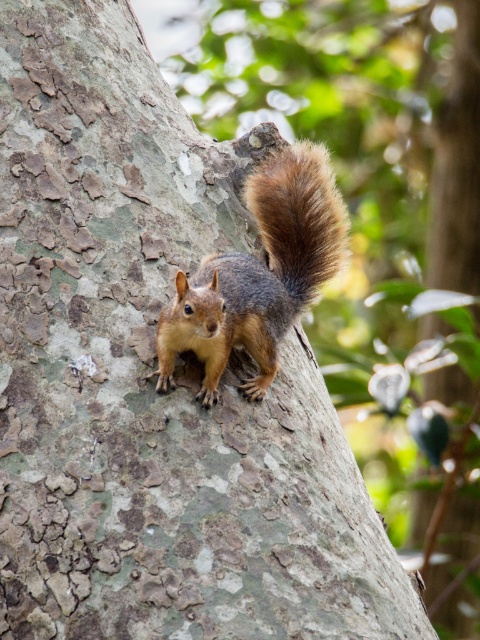
Question: Which of the following is the farthest from the observer?

Choices:
 (A) shiny brown fur squirrel at center
 (B) fuzzy brown tail at upper right

Answer: (B)

Question: Observing the image, what is the correct spatial positioning of shiny brown fur squirrel at center in reference to fuzzy brown tail at upper right?

Choices:
 (A) left
 (B) right

Answer: (A)

Question: Which point is closer to the camera taking this photo?

Choices:
 (A) (280, 184)
 (B) (162, 378)

Answer: (B)

Question: Does shiny brown fur squirrel at center have a larger size compared to fuzzy brown tail at upper right?

Choices:
 (A) yes
 (B) no

Answer: (A)

Question: Can you confirm if shiny brown fur squirrel at center is positioned above fuzzy brown tail at upper right?

Choices:
 (A) no
 (B) yes

Answer: (A)